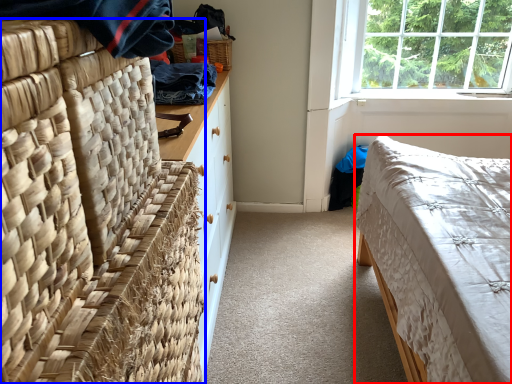
Question: Which point is further to the camera, bed (highlighted by a red box) or furniture (highlighted by a blue box)?

Choices:
 (A) bed
 (B) furniture

Answer: (A)